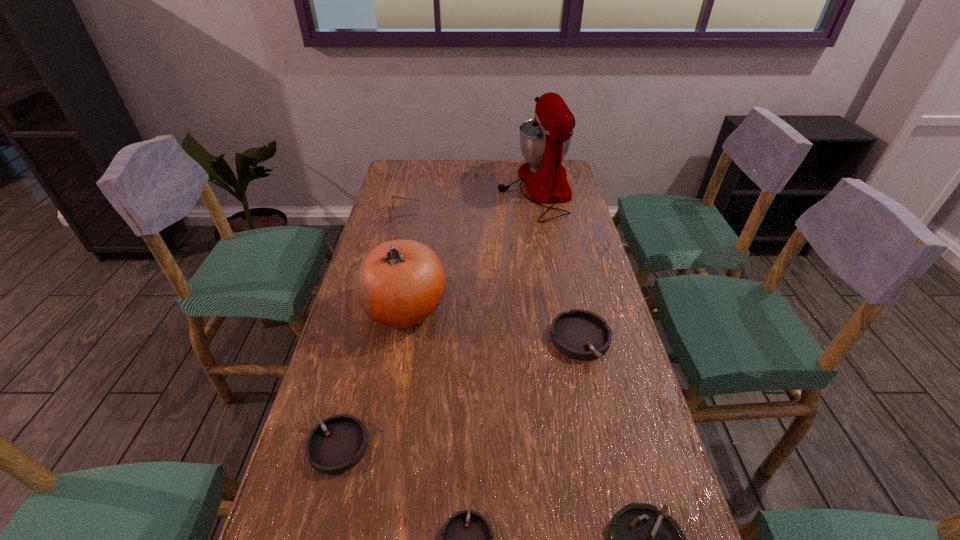
This screenshot has width=960, height=540. What are the coordinates of `ashtray located at the left edge` in the screenshot? It's located at (335, 445).

Where is `mixer located in the right edge section of the desktop`? mixer located in the right edge section of the desktop is located at coordinates (545, 140).

Locate an element on the screen. The width and height of the screenshot is (960, 540). ashtray at the right edge is located at coordinates (579, 334).

Where is `object that is at the far right corner`? This screenshot has height=540, width=960. object that is at the far right corner is located at coordinates pyautogui.click(x=545, y=140).

I want to click on vacant space at the far edge of the desktop, so click(x=432, y=164).

I want to click on vacant space at the left edge, so click(x=322, y=381).

Find the location of a particular element. vacant region at the right edge of the desktop is located at coordinates (580, 287).

Where is `free space between the spectacles and the fourth tallest object`? The image size is (960, 540). free space between the spectacles and the fourth tallest object is located at coordinates (492, 278).

This screenshot has height=540, width=960. What are the coordinates of `free point between the farthest ashtray and the sixth shortest object` in the screenshot? It's located at (492, 324).

The height and width of the screenshot is (540, 960). Find the location of `the closest object to the sixth shortest object`. the closest object to the sixth shortest object is located at coordinates [x=335, y=445].